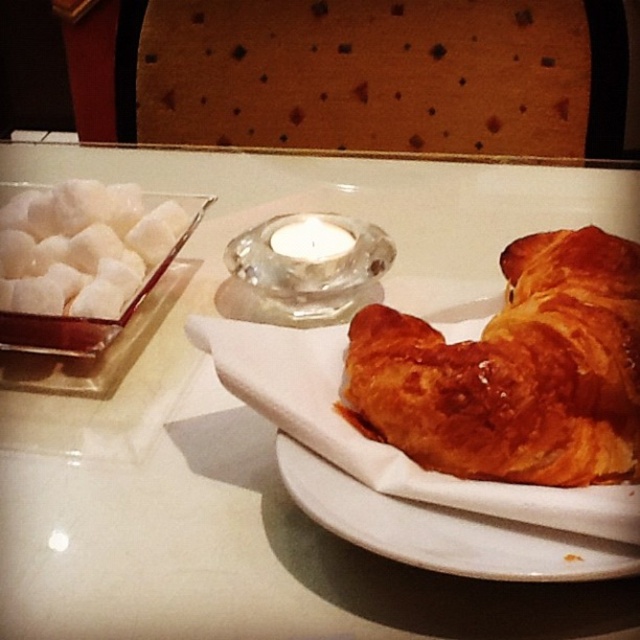
You are a chef preparing a dessert display and need to place a 4 inch wide cake between the white sugar cubes at left and the translucent glass candle at center. Is there enough space?

The distance between the white sugar cubes at left and the translucent glass candle at center is 3.67 inches, which is less than the 4 inch width of the cake. Therefore, there is not enough space to place the cake between them.

You are setting up a table for a tea party and need to place the white sugar cubes at left and the white ceramic plate at lower right. According to the image, where should you position the sugar cubes relative to the plate?

The white sugar cubes at left should be placed above the white ceramic plate at lower right as shown in the image.

You are holding a small toy that is 10 inches long. You want to place it on the table so that it is exactly at the point marked as point [38,211]. Will the toy fit entirely within the table if you place it there?

The distance of point [38,211] from camera is 12.53 inches. Since the toy is 10 inches long, it will fit entirely within the table if placed at that point as the distance is sufficient.